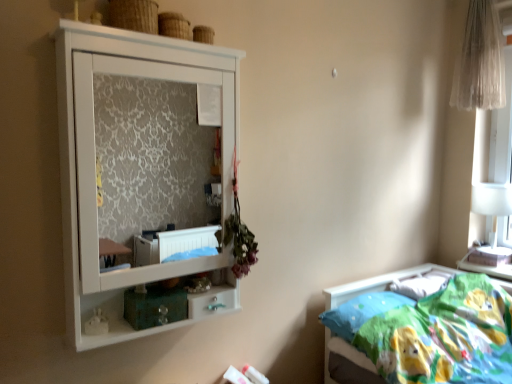
Question: In the image, is white glossy table lamp at right on the left side or the right side of wooden textured basket at upper center?

Choices:
 (A) left
 (B) right

Answer: (B)

Question: Relative to wooden textured basket at upper center, is white glossy table lamp at right in front or behind?

Choices:
 (A) behind
 (B) front

Answer: (A)

Question: Based on their relative distances, which object is nearer to the white glossy drawer at lower center?

Choices:
 (A) wooden textured basket at upper center
 (B) white matte cupboard at upper left
 (C) sheer white curtain at upper right
 (D) white glossy table lamp at right
 (E) soft cotton bed at lower right

Answer: (E)

Question: Estimate the real-world distances between objects in this image. Which object is closer to the soft cotton bed at lower right?

Choices:
 (A) sheer white curtain at upper right
 (B) white glossy table lamp at right
 (C) blue fabric pillow at lower right
 (D) wooden textured basket at upper center
 (E) white matte cupboard at upper left

Answer: (C)